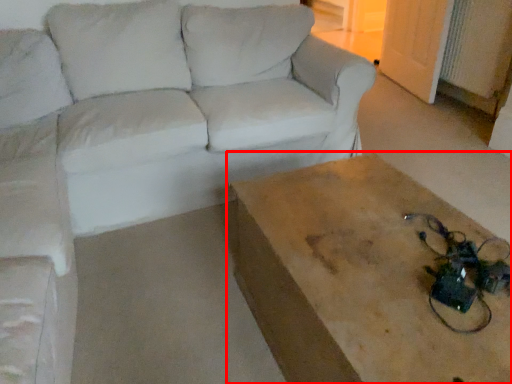
Question: In this image, where is table (annotated by the red box) located relative to studio couch?

Choices:
 (A) left
 (B) right

Answer: (B)